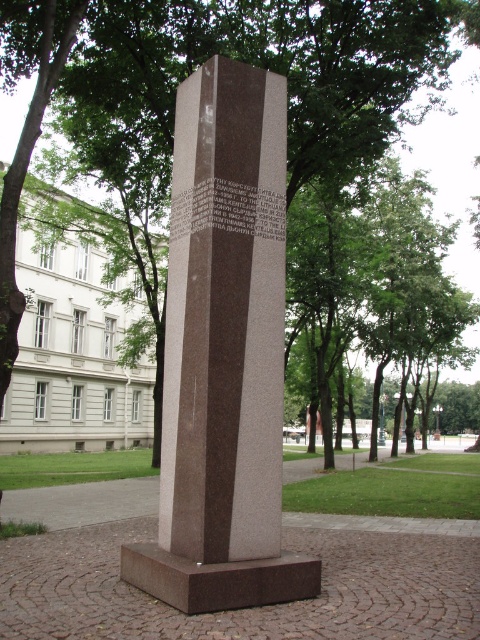
In the scene shown: You are standing in the park and want to take a photo of both the brown polished stone monument at center and the green leafy tree at center. Which object should you focus on first if you want to capture both in the same frame without moving your camera?

The brown polished stone monument at center is shorter than the green leafy tree at center. To capture both in the same frame without moving the camera, focus on the brown polished stone monument at center first since it is shorter and closer to the camera, allowing the taller tree to fit into the background.

You are a landscape architect designing a new garden. You want to place a new statue that is 2 meters wide between the brown polished stone monument at center and the green leafy tree at center. Can the statue fit between them without overlapping either object?

The brown polished stone monument at center is 8.29 meters away from the green leafy tree at center. Since the statue is only 2 meters wide, there is sufficient space between them to place the statue without overlapping either object.